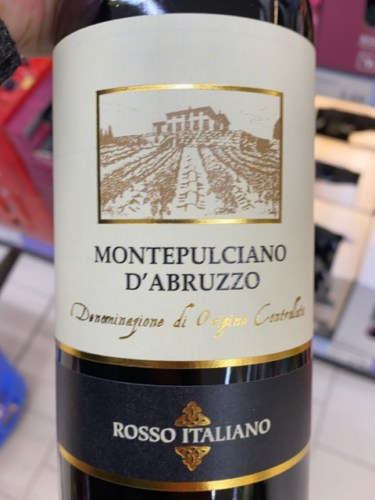
Where is `candle`? candle is located at coordinates (196, 406).